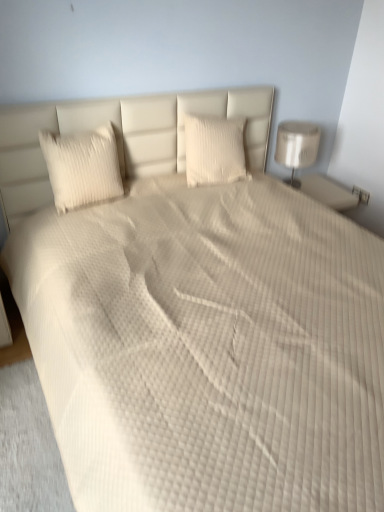
At what (x,y) coordinates should I click in order to perform the action: click on vacant space underneath white glossy lamp at right (from a real-world perspective). Please return your answer as a coordinate pair (x, y). Looking at the image, I should click on (302, 180).